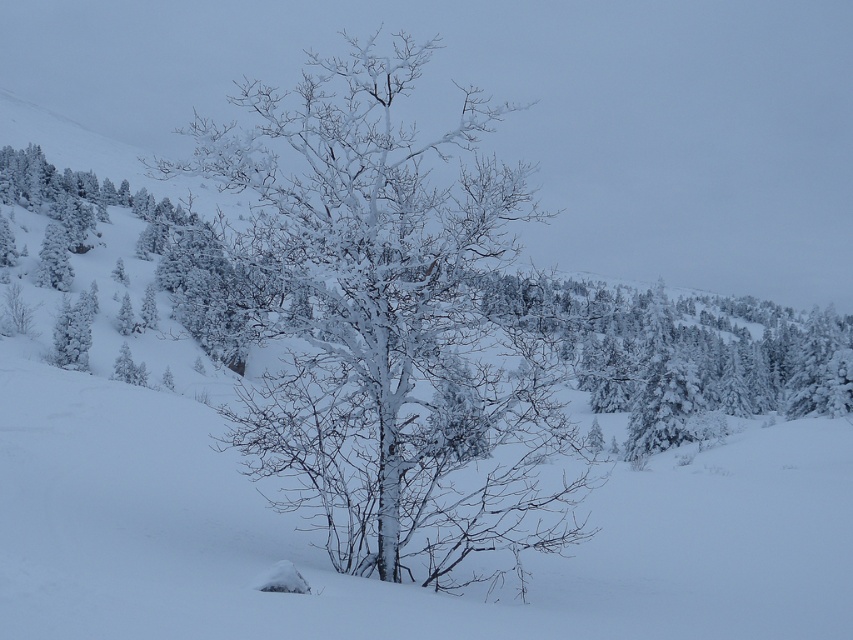
Question: Which of the following is the closest to the observer?

Choices:
 (A) (71, 243)
 (B) (537, 468)

Answer: (B)

Question: Which point is closer to the camera taking this photo?

Choices:
 (A) (403, 289)
 (B) (71, 198)

Answer: (A)

Question: Is snow-covered branches at center to the left of white frosty tree at upper left from the viewer's perspective?

Choices:
 (A) no
 (B) yes

Answer: (A)

Question: Is the position of snow-covered branches at center less distant than that of white frosty tree at upper left?

Choices:
 (A) no
 (B) yes

Answer: (B)

Question: Is snow-covered branches at center in front of white frosty tree at upper left?

Choices:
 (A) yes
 (B) no

Answer: (A)